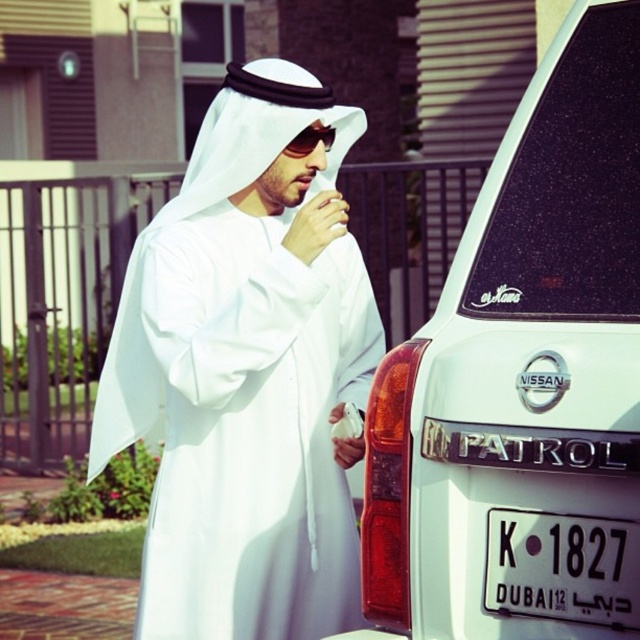
You are a delivery person trying to load a box onto the roof of the white matte nissan patrol at right. The box is 1 meter tall. Considering the height of the shiny black sunglasses at center, which are at eye level, can you estimate if the box will fit on the roof without exceeding the height limit?

The white matte nissan patrol at right is taller than the shiny black sunglasses at center. Since the sunglasses are at eye level, the car is taller than the box which is 1 meter tall, so the box will fit on the roof.

In the scene shown: You are a delivery person trying to attach a GPS tracker to the shiny black sunglasses at center. The GPS tracker has a maximum range of 5 feet. Can you place the tracker on the black plastic license plate at lower right and still have it work?

The distance between the black plastic license plate at lower right and the shiny black sunglasses at center is 5.49 feet. Since the GPS tracker has a maximum range of 5 feet, placing it on the license plate would exceed the tracker range, so it won

You are a drone operator trying to capture a photo of the man and the car in the scene. You need to ensure that both points, point (x=502, y=577) and point (x=314, y=134), are clearly visible in the photo. Given their positions, which point should you focus on first to ensure proper depth of field?

You should focus on point (x=314, y=134) first because it is farther from the camera than point (x=502, y=577). Proper depth of field requires focusing on the farther object to ensure both are in focus.